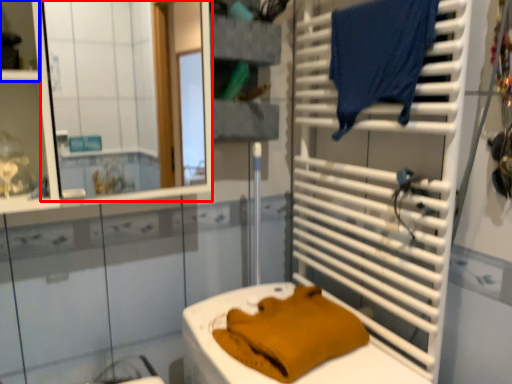
Question: Which object appears farthest to the camera in this image, mirror (highlighted by a red box) or shelf (highlighted by a blue box)?

Choices:
 (A) mirror
 (B) shelf

Answer: (B)